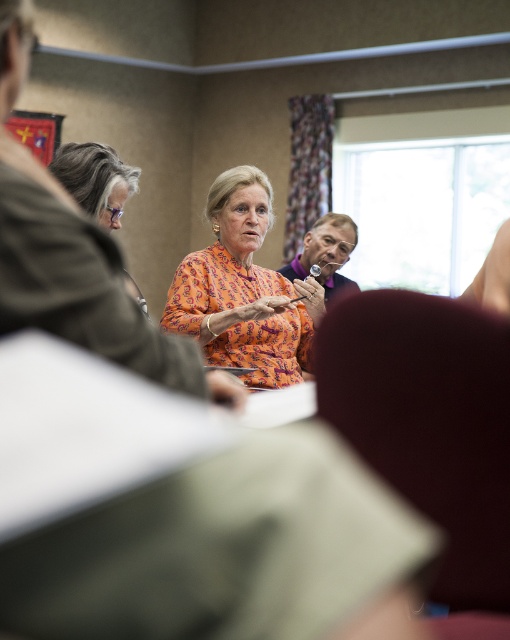
Question: Among these points, which one is nearest to the camera?

Choices:
 (A) (241, 364)
 (B) (89, 166)

Answer: (B)

Question: Can you confirm if orange printed blouse at center is smaller than gray hair at left?

Choices:
 (A) no
 (B) yes

Answer: (A)

Question: Is orange printed blouse at center further to camera compared to gray hair at left?

Choices:
 (A) no
 (B) yes

Answer: (B)

Question: Does orange printed blouse at center lie behind gray hair at left?

Choices:
 (A) no
 (B) yes

Answer: (B)